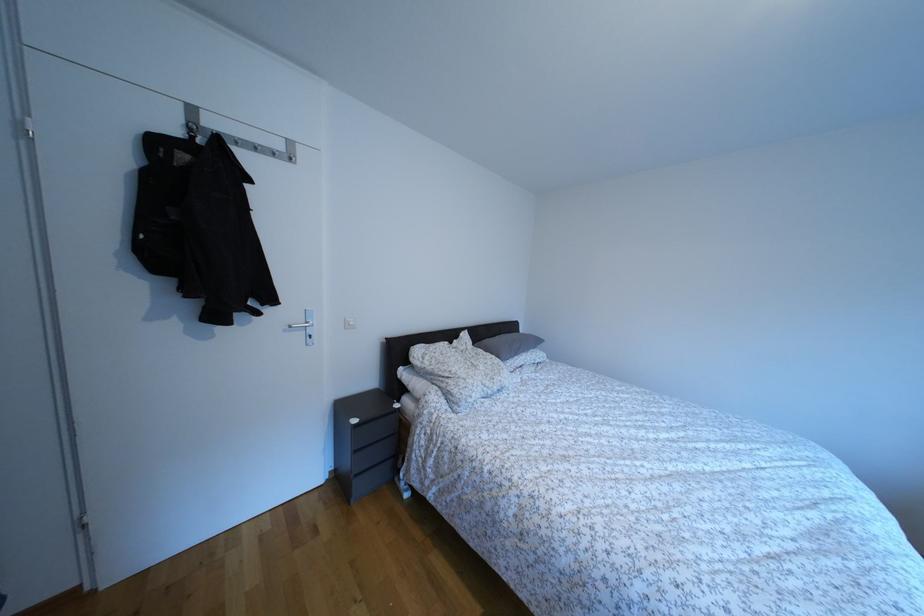
Identify the location of white light switch. The width and height of the screenshot is (924, 616). (349, 322).